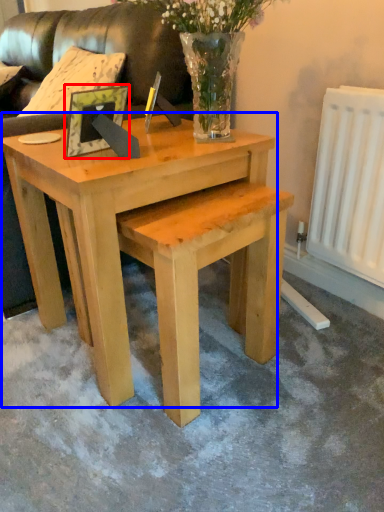
Question: Which object is further to the camera taking this photo, picture frame (highlighted by a red box) or coffee table (highlighted by a blue box)?

Choices:
 (A) picture frame
 (B) coffee table

Answer: (A)